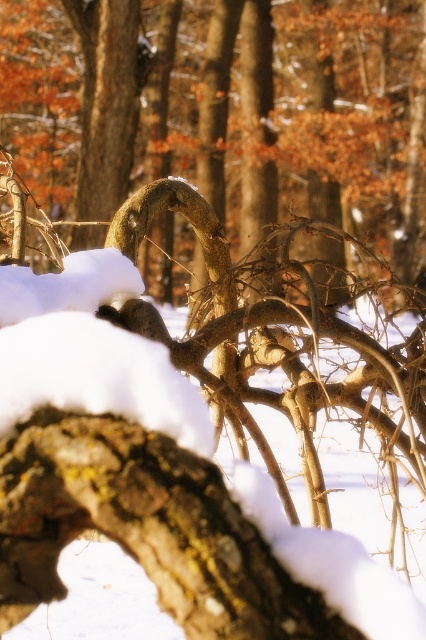
Question: Which object appears closest to the camera in this image?

Choices:
 (A) smooth bark tree trunk at center
 (B) brown rough tree trunk at upper center

Answer: (B)

Question: Is smooth bark tree trunk at center above brown rough tree trunk at upper center?

Choices:
 (A) no
 (B) yes

Answer: (B)

Question: Is the position of smooth bark tree trunk at center more distant than that of brown rough tree trunk at upper center?

Choices:
 (A) yes
 (B) no

Answer: (A)

Question: Can you confirm if smooth bark tree trunk at center is bigger than brown rough tree trunk at upper center?

Choices:
 (A) no
 (B) yes

Answer: (B)